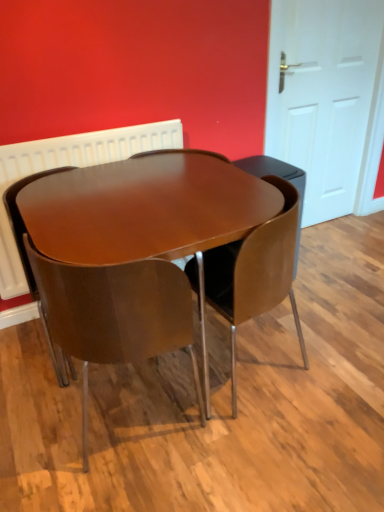
You are a GUI agent. You are given a task and a screenshot of the screen. Output one action in this format:
    pyautogui.click(x=<x>, y=<y>)
    Task: Click on the vacant space in front of glossy wood chair at center, which is counted as the third chair, starting from the right
    This screenshot has width=384, height=512.
    Given the screenshot: What is the action you would take?
    pyautogui.click(x=38, y=401)